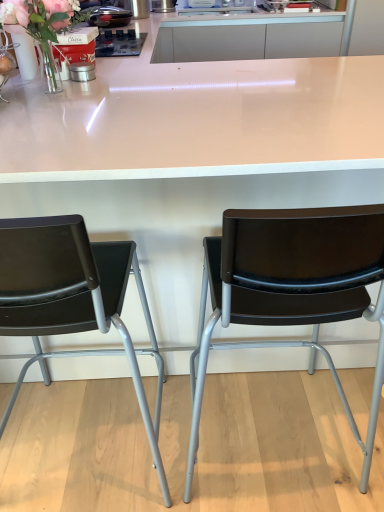
This screenshot has width=384, height=512. Identify the location of vacant area that lies between black plastic chair at center, which is counted as the 2th chair, starting from the left, and matte black chair at left, the 2th chair viewed from the right. (180, 444).